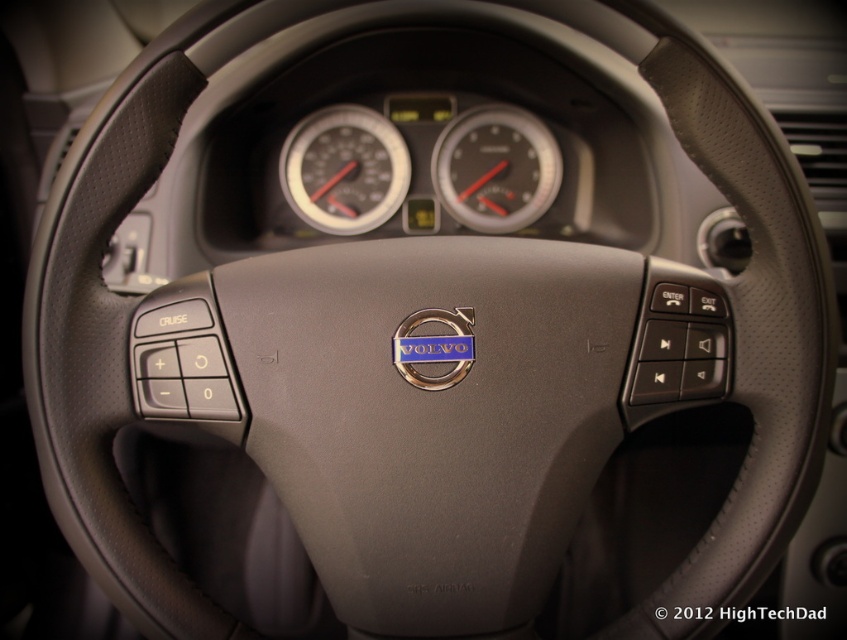
Which of these two, matte black speedometer at center or black plastic speedometer at center, stands taller?

With more height is matte black speedometer at center.

Does matte black speedometer at center appear on the left side of black plastic speedometer at center?

Correct, you'll find matte black speedometer at center to the left of black plastic speedometer at center.

This screenshot has height=640, width=847. Describe the element at coordinates (344, 170) in the screenshot. I see `matte black speedometer at center` at that location.

At what (x,y) coordinates should I click in order to perform the action: click on matte black speedometer at center. Please return your answer as a coordinate pair (x, y). Looking at the image, I should click on (344, 170).